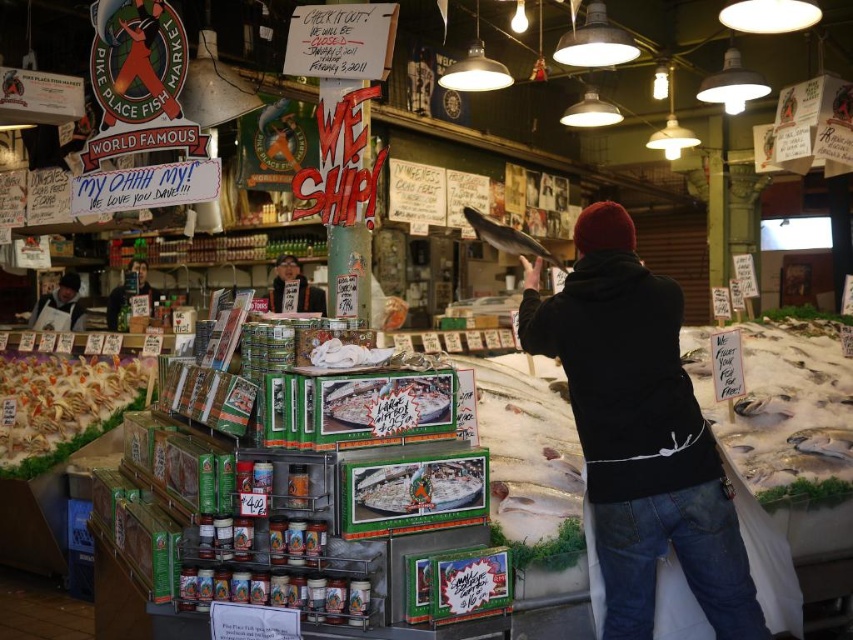
Between white paper label at center and shiny silver fish at center, which one is positioned lower?

white paper label at center is lower down.

Is white paper label at center to the left of shiny silver fish at center from the viewer's perspective?

Correct, you'll find white paper label at center to the left of shiny silver fish at center.

Between point (399, 394) and point (505, 237), which one is positioned in front?

Point (399, 394) is in front.

This screenshot has height=640, width=853. I want to click on white paper label at center, so click(386, 403).

Consider the image. Who is lower down, white crumbly food at lower left or shiny silver fish at center?

Positioned lower is white crumbly food at lower left.

Can you confirm if white crumbly food at lower left is positioned above shiny silver fish at center?

Actually, white crumbly food at lower left is below shiny silver fish at center.

Is point (125, 392) positioned after point (506, 243)?

Yes, point (125, 392) is farther from viewer.

This screenshot has height=640, width=853. In order to click on white crumbly food at lower left in this screenshot , I will do `click(62, 404)`.

What do you see at coordinates (639, 433) in the screenshot?
I see `black matte jacket at center` at bounding box center [639, 433].

Between black matte jacket at center and matte black phone at left, which one appears on the right side from the viewer's perspective?

black matte jacket at center is more to the right.

Is point (700, 544) positioned before point (141, 278)?

Yes.

At what (x,y) coordinates should I click in order to perform the action: click on black matte jacket at center. Please return your answer as a coordinate pair (x, y). The image size is (853, 640). Looking at the image, I should click on (639, 433).